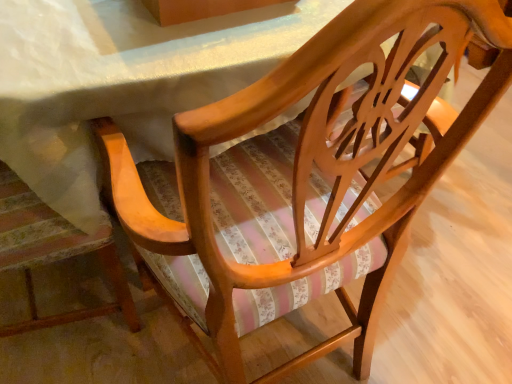
Looking at this image, measure the distance between matte wood table at center and camera.

The distance of matte wood table at center from camera is 23.14 inches.

Describe the element at coordinates (123, 82) in the screenshot. I see `matte wood table at center` at that location.

At what (x,y) coordinates should I click in order to perform the action: click on matte wood table at center. Please return your answer as a coordinate pair (x, y). Looking at the image, I should click on (123, 82).

Locate an element on the screen. The height and width of the screenshot is (384, 512). matte wood table at center is located at coordinates (123, 82).